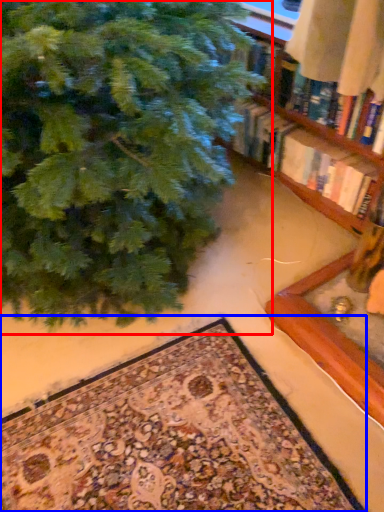
Question: Which object is closer to the camera taking this photo, christmas tree (highlighted by a red box) or mat (highlighted by a blue box)?

Choices:
 (A) christmas tree
 (B) mat

Answer: (A)